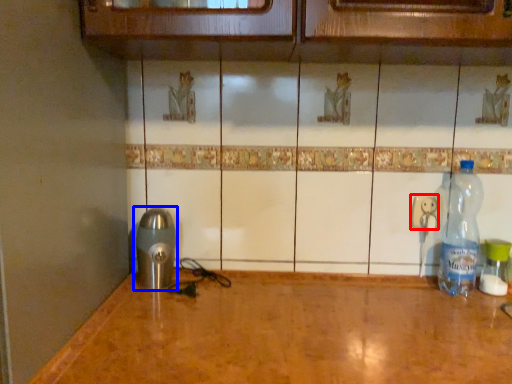
Question: Which object appears closest to the camera in this image, electric outlet (highlighted by a red box) or appliance (highlighted by a blue box)?

Choices:
 (A) electric outlet
 (B) appliance

Answer: (B)